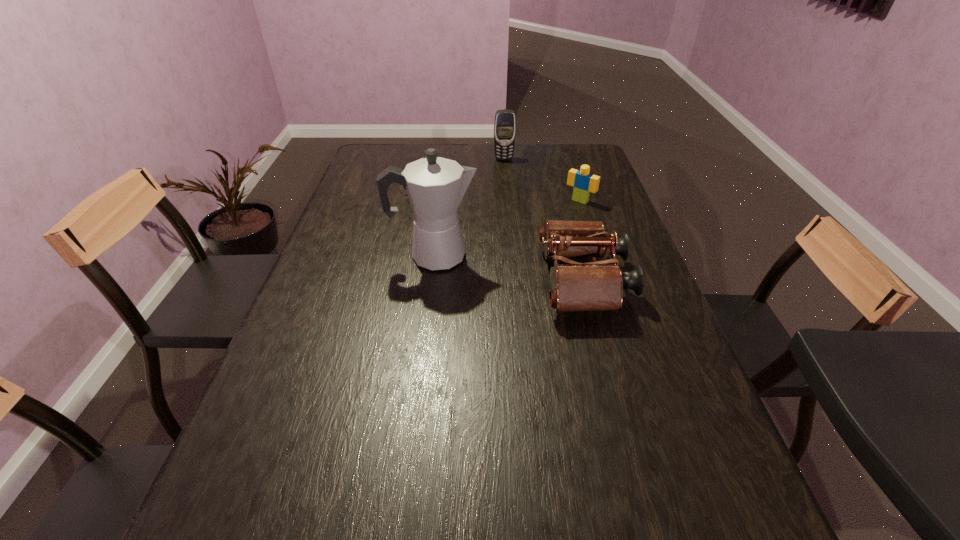
Locate an element on the screen. vacant space that satisfies the following two spatial constraints: 1. on the front side of the third farthest object; 2. on the left side of the cellular telephone is located at coordinates (508, 201).

You are a GUI agent. You are given a task and a screenshot of the screen. Output one action in this format:
    pyautogui.click(x=<x>, y=<y>)
    Task: Click on the vacant space that satisfies the following two spatial constraints: 1. on the front side of the fourth shortest object; 2. through the eyepieces of the binoculars
    Image resolution: width=960 pixels, height=540 pixels.
    Given the screenshot: What is the action you would take?
    pyautogui.click(x=515, y=281)